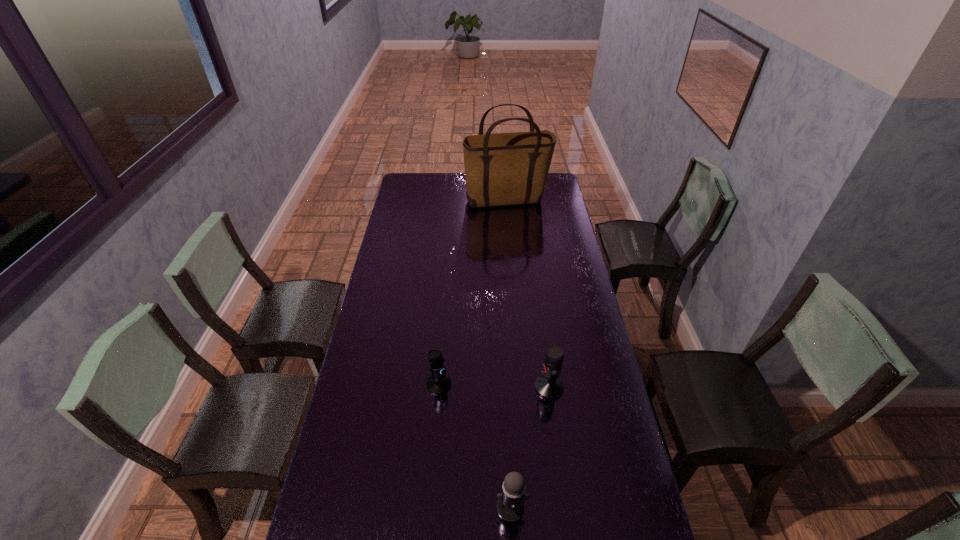
Find the location of a particular element. This screenshot has width=960, height=540. the farthest object is located at coordinates (502, 169).

The width and height of the screenshot is (960, 540). I want to click on the tallest object, so click(502, 169).

This screenshot has height=540, width=960. What are the coordinates of `the nearest object` in the screenshot? It's located at (510, 506).

You are a GUI agent. You are given a task and a screenshot of the screen. Output one action in this format:
    pyautogui.click(x=<x>, y=<y>)
    Task: Click on the nearest microphone
    The width and height of the screenshot is (960, 540).
    Given the screenshot: What is the action you would take?
    pyautogui.click(x=510, y=506)

Find the location of a particular element. the rightmost microphone is located at coordinates (549, 385).

Image resolution: width=960 pixels, height=540 pixels. Find the location of `the shortest microphone`. the shortest microphone is located at coordinates (439, 382).

At what (x,y) coordinates should I click in order to perform the action: click on the leftmost microphone. Please return your answer as a coordinate pair (x, y). The height and width of the screenshot is (540, 960). Looking at the image, I should click on (439, 382).

Locate an element on the screen. The image size is (960, 540). vacant space located 0.390m on the front of the farthest object is located at coordinates (513, 260).

The image size is (960, 540). What are the coordinates of `free space located 0.090m on the right of the nearest object` in the screenshot? It's located at (560, 507).

Image resolution: width=960 pixels, height=540 pixels. I want to click on free space located on the side of the rightmost microphone with the red ring, so click(444, 387).